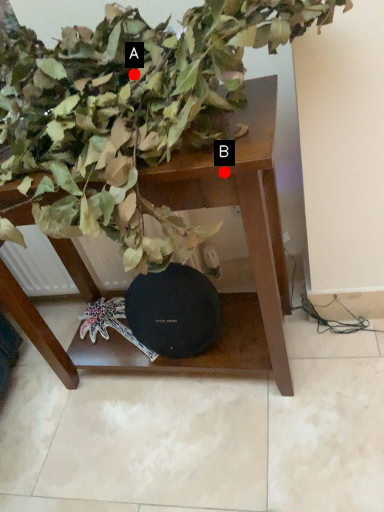
Question: Two points are circled on the image, labeled by A and B beside each circle. Among these points, which one is farthest from the camera?

Choices:
 (A) A is further
 (B) B is further

Answer: (A)